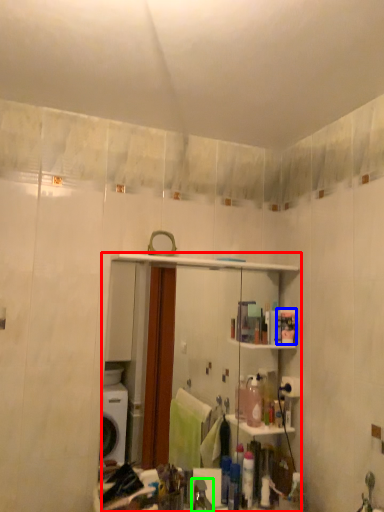
Question: Which object is the closest to the mirror (highlighted by a red box)? Choose among these: toiletry (highlighted by a blue box) or faucet (highlighted by a green box).

Choices:
 (A) toiletry
 (B) faucet

Answer: (A)